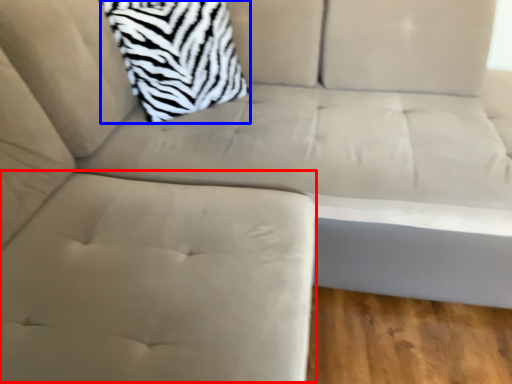
Question: Which point is closer to the camera, swivel chair (highlighted by a red box) or throw pillow (highlighted by a blue box)?

Choices:
 (A) swivel chair
 (B) throw pillow

Answer: (A)